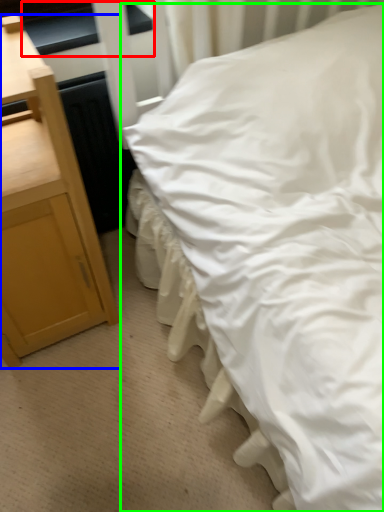
Question: Considering the real-world distances, which object is farthest from window sill (highlighted by a red box)? nightstand (highlighted by a blue box) or bed (highlighted by a green box)?

Choices:
 (A) nightstand
 (B) bed

Answer: (B)